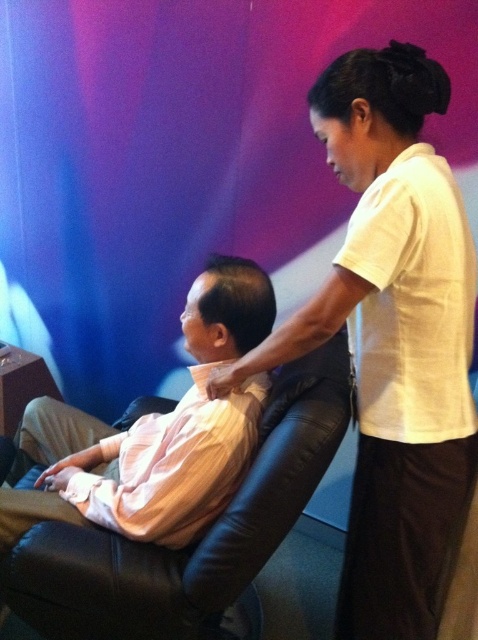
Is point (410, 472) farther from viewer compared to point (149, 572)?

That is False.

Can you confirm if white cotton shirt at upper right is positioned below black leather swivel chair at center?

No.

I want to click on white cotton shirt at upper right, so click(392, 337).